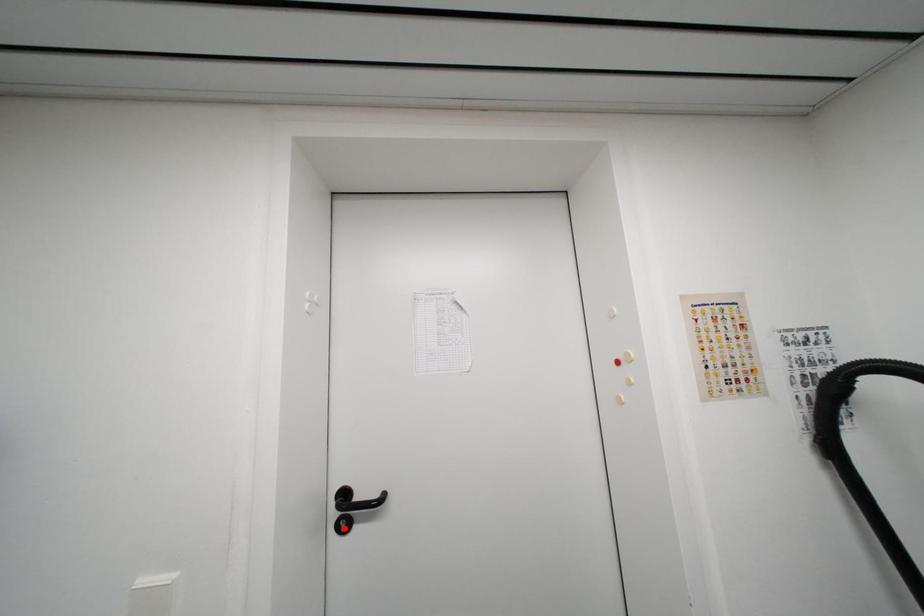
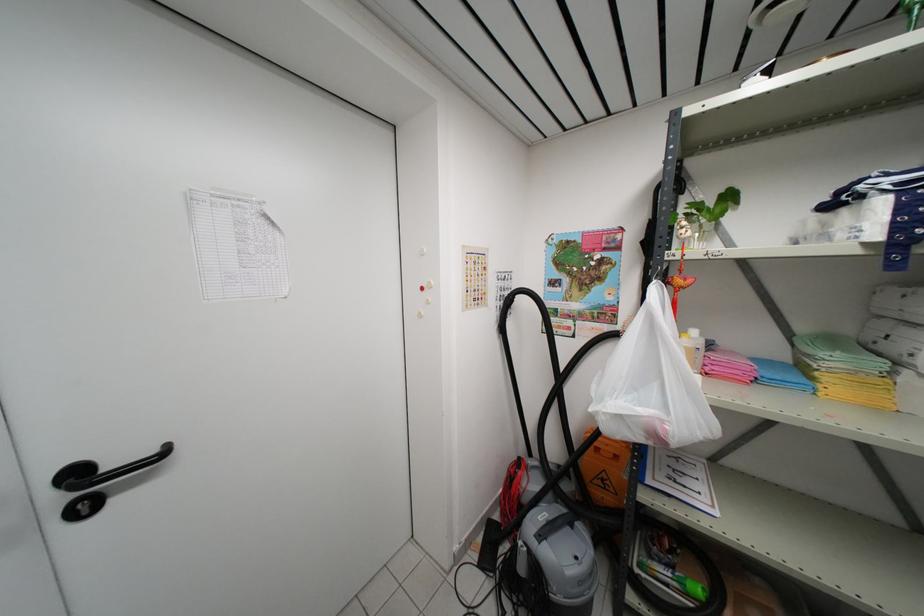
In the second image, find the point that corresponds to the highlighted location in the first image.

(83, 512)